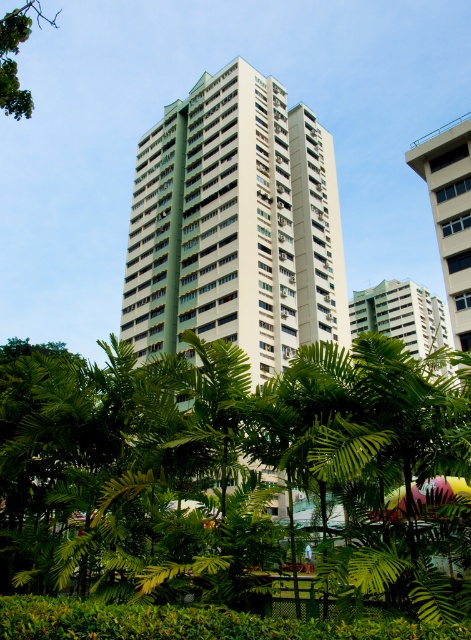
You are a drone operator trying to capture a photo of the white concrete building at upper right and the green leafy tree at center. From your current position, which object is positioned lower in the frame?

The green leafy tree at center is positioned below the white concrete building at upper right, so it is lower in the frame.

You are standing in the middle of a park and see the green leafy tree at center and the white concrete building at upper right. Which object is closer to you?

The green leafy tree at center is closer to you because it is in front of the white concrete building at upper right.

From the picture: You are standing in the middle of a city park and see the white concrete building at upper right and the green leafy tree at upper left in the distance. Which object is closer to you?

The white concrete building at upper right is closer to you because it is positioned further to the viewer than the green leafy tree at upper left.